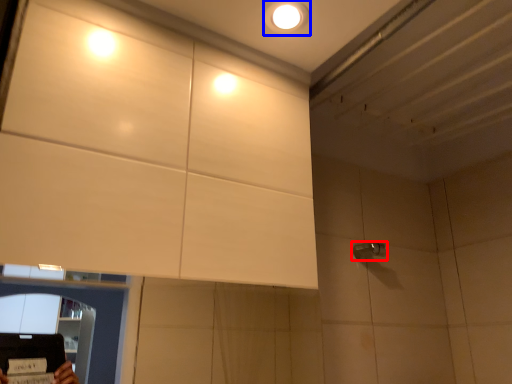
Question: Among these objects, which one is farthest to the camera, shower (highlighted by a red box) or droplight (highlighted by a blue box)?

Choices:
 (A) shower
 (B) droplight

Answer: (A)